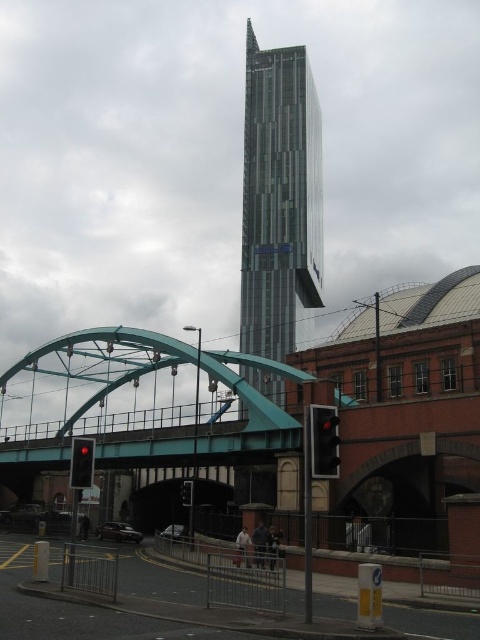
Question: Considering the relative positions of red glass traffic light at lower left and black plastic traffic light at lower center in the image provided, where is red glass traffic light at lower left located with respect to black plastic traffic light at lower center?

Choices:
 (A) left
 (B) right

Answer: (A)

Question: Is glassy steel tower at center thinner than red glass traffic light at lower left?

Choices:
 (A) yes
 (B) no

Answer: (B)

Question: Which of these objects is positioned closest to the black plastic traffic light at lower center?

Choices:
 (A) red glass traffic light at lower left
 (B) glassy steel tower at center
 (C) matte black traffic light at center

Answer: (A)

Question: Does glassy steel tower at center appear under red glass traffic light at lower left?

Choices:
 (A) yes
 (B) no

Answer: (B)

Question: Which of the following is the farthest from the observer?

Choices:
 (A) red glass traffic light at lower left
 (B) glassy steel tower at center
 (C) matte black traffic light at center

Answer: (B)

Question: Which of the following is the closest to the observer?

Choices:
 (A) glassy steel tower at center
 (B) black plastic traffic light at lower center

Answer: (B)